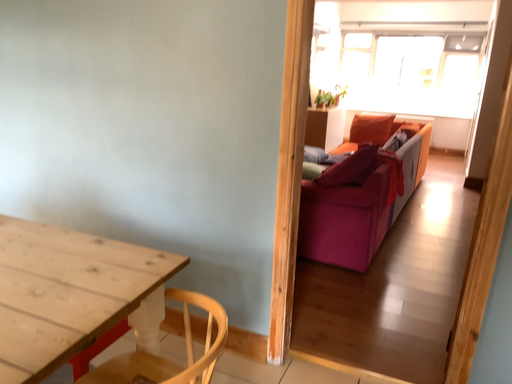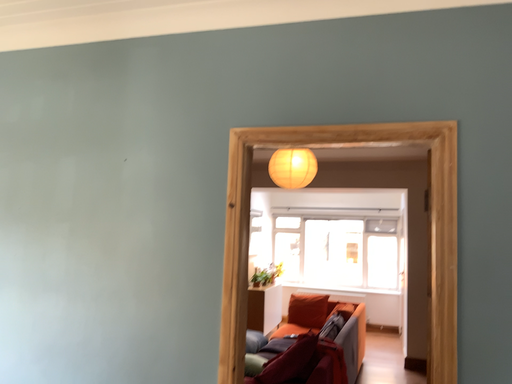
Question: Which way did the camera rotate in the video?

Choices:
 (A) rotated downward
 (B) rotated upward

Answer: (B)